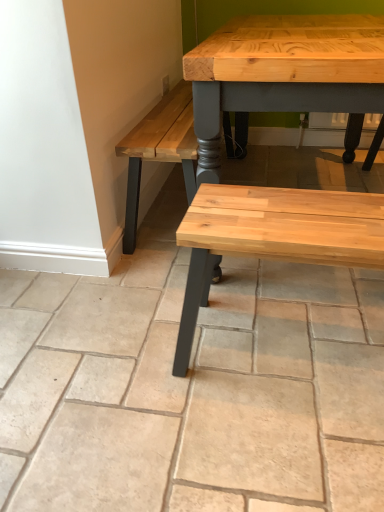
The image size is (384, 512). I want to click on vacant area on top of natural wood bench at center (from a real-world perspective), so [x=292, y=210].